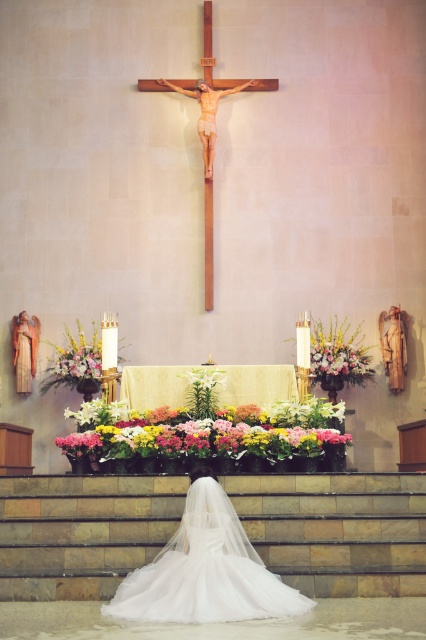
You are a photographer planning to take a photo of the white tulle dress at lower center and the matte gold statue at upper center. You want to ensure both are in focus. Since the statue is taller, would you need to adjust your camera settings to account for depth of field?

The white tulle dress at lower center is not as tall as the matte gold statue at upper center. To ensure both are in focus, you should adjust your camera settings to increase the depth of field, which allows for a greater range of distances to be in focus simultaneously.

You are standing in the church and want to place a new candle on the altar. The altar has a coordinate system where the bottom left corner is the origin. The existing vibrant floral bouquet at center is located at point (x=207, y=432). To ensure proper spacing, you need to place the candle at least 0.1 units away from the bouquet. Where should you place the candle?

The vibrant floral bouquet at center is located at point (x=207, y=432). To place the candle at least 0.1 units away, you can position it at coordinates such as 0.775, 0.488, which is 0.1 units to the right of the bouquet, ensuring proper spacing.

You are an interior designer planning to place a new artwork between the vibrant floral bouquet at center and the matte gold statue at upper center. Considering their widths, which object should you use as a reference to ensure the new artwork fits proportionally?

The vibrant floral bouquet at center is wider than the matte gold statue at upper center. To ensure the new artwork fits proportionally, you should use the width of the vibrant floral bouquet at center as a reference since it is wider and will provide a better proportional guideline.